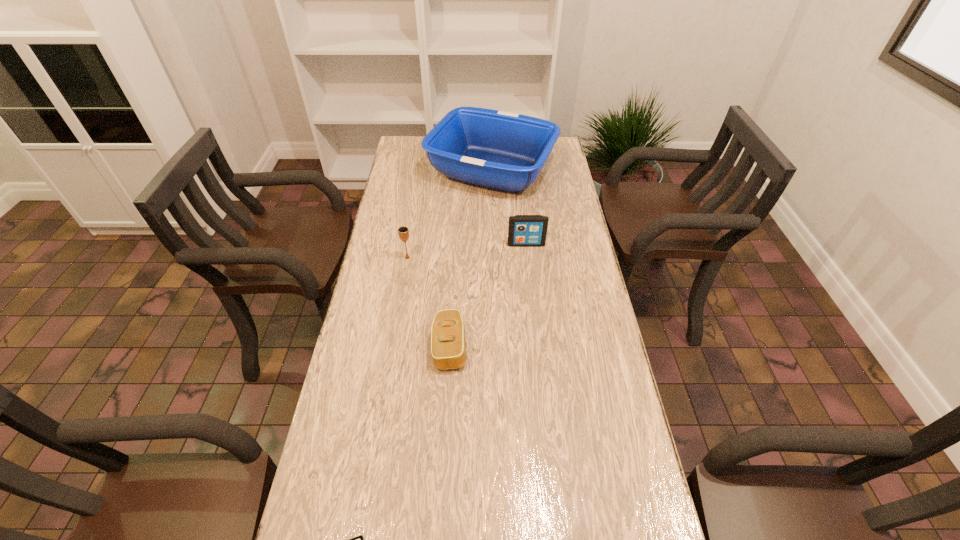
You are a GUI agent. You are given a task and a screenshot of the screen. Output one action in this format:
    pyautogui.click(x=<x>, y=<y>)
    Task: Click on the tallest object
    The width and height of the screenshot is (960, 540).
    Given the screenshot: What is the action you would take?
    pyautogui.click(x=505, y=151)

Identify the location of tray. The height and width of the screenshot is (540, 960). (505, 151).

Where is `the third nearest object`? the third nearest object is located at coordinates (403, 231).

The width and height of the screenshot is (960, 540). I want to click on the fourth nearest object, so click(523, 230).

Where is `the taller iPod`? the taller iPod is located at coordinates 523,230.

In order to click on clutch bag in this screenshot , I will do `click(448, 346)`.

The height and width of the screenshot is (540, 960). What are the coordinates of `the second nearest object` in the screenshot? It's located at (448, 346).

Locate an element on the screen. vacant space located 0.100m on the left of the tray is located at coordinates (x=402, y=170).

Where is `free space located on the front of the third farthest object`? The image size is (960, 540). free space located on the front of the third farthest object is located at coordinates (400, 302).

Where is `free space located 0.240m on the front screen of the right iPod`? The width and height of the screenshot is (960, 540). free space located 0.240m on the front screen of the right iPod is located at coordinates (532, 299).